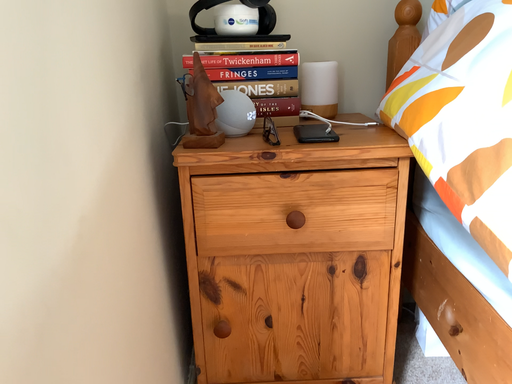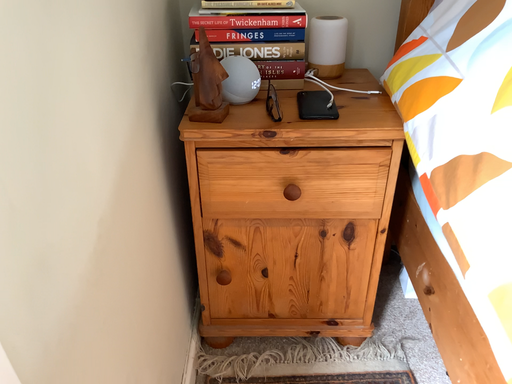
Question: Which way did the camera rotate in the video?

Choices:
 (A) rotated downward
 (B) rotated upward

Answer: (A)